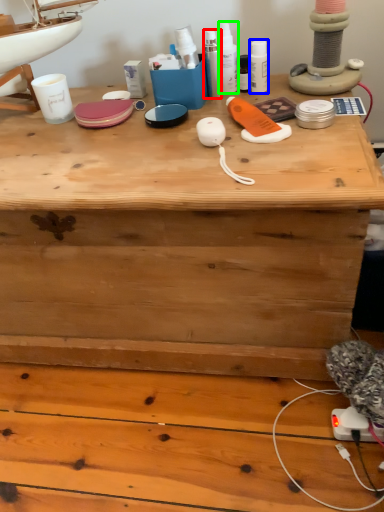
Question: Considering the real-world distances, which object is closest to toiletry (highlighted by a red box)? toiletry (highlighted by a blue box) or toiletry (highlighted by a green box).

Choices:
 (A) toiletry
 (B) toiletry

Answer: (B)